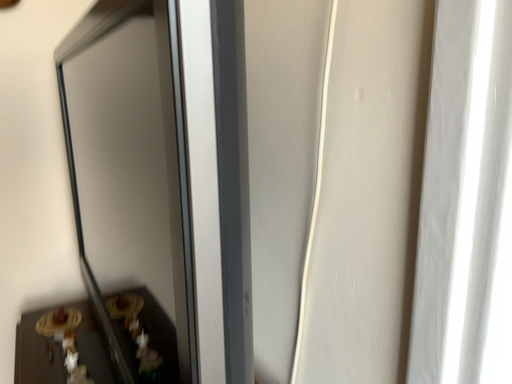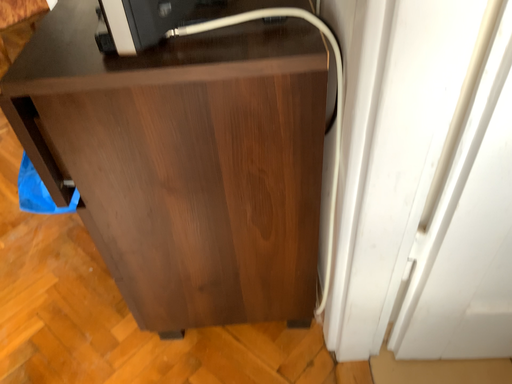
Question: How did the camera likely rotate when shooting the video?

Choices:
 (A) rotated downward
 (B) rotated upward

Answer: (A)